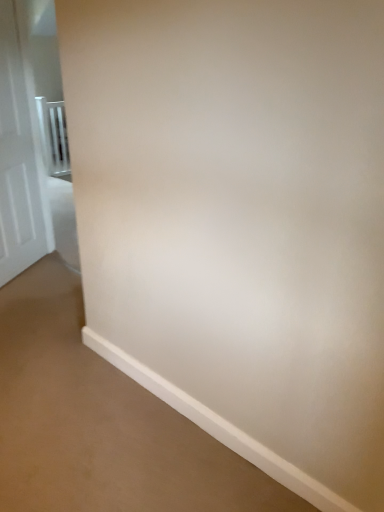
Where is `vacant region under white glossy door at left (from a real-world perspective)`? vacant region under white glossy door at left (from a real-world perspective) is located at coordinates (24, 271).